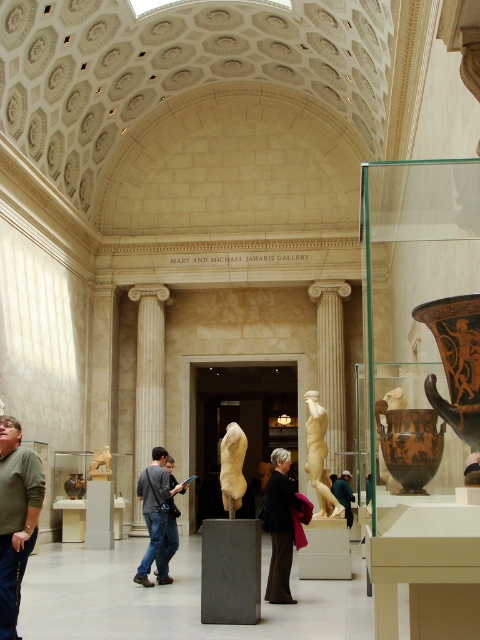
Is white marble column at center to the left of beige marble torso at center from the viewer's perspective?

Yes, white marble column at center is to the left of beige marble torso at center.

Measure the distance between point (156,352) and camera.

Point (156,352) is 240.13 feet from camera.

Locate an element on the screen. white marble column at center is located at coordinates (148, 371).

Is green matte sweater at lower left to the right of beige marble torso at center from the viewer's perspective?

No, green matte sweater at lower left is not to the right of beige marble torso at center.

Does green matte sweater at lower left have a lesser height compared to beige marble torso at center?

Yes, green matte sweater at lower left is shorter than beige marble torso at center.

Is point (4, 436) closer to viewer compared to point (222, 456)?

Yes, point (4, 436) is in front of point (222, 456).

What are the coordinates of `green matte sweater at lower left` in the screenshot? It's located at (15, 516).

Which is in front, point (392, 429) or point (283, 449)?

Point (392, 429)

Which of these two, brown glossy vase at right or dark brown leather jacket at center, stands shorter?

brown glossy vase at right

Is point (399, 429) farther from viewer compared to point (264, 499)?

No, it is not.

In order to click on brown glossy vase at right in this screenshot , I will do `click(409, 444)`.